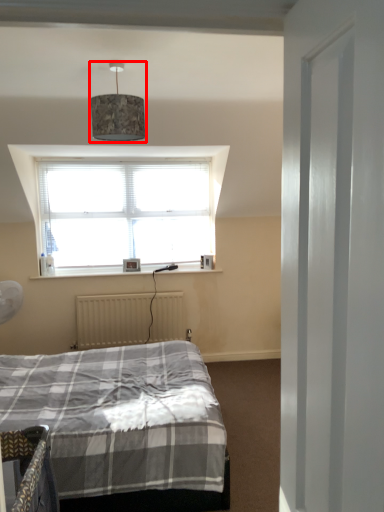
Question: From the image's perspective, where is lamp (annotated by the red box) located in relation to radiator in the image?

Choices:
 (A) above
 (B) below

Answer: (A)